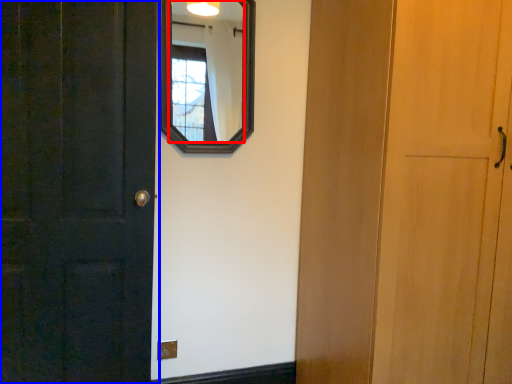
Question: Which object appears farthest to the camera in this image, mirror (highlighted by a red box) or door (highlighted by a blue box)?

Choices:
 (A) mirror
 (B) door

Answer: (A)